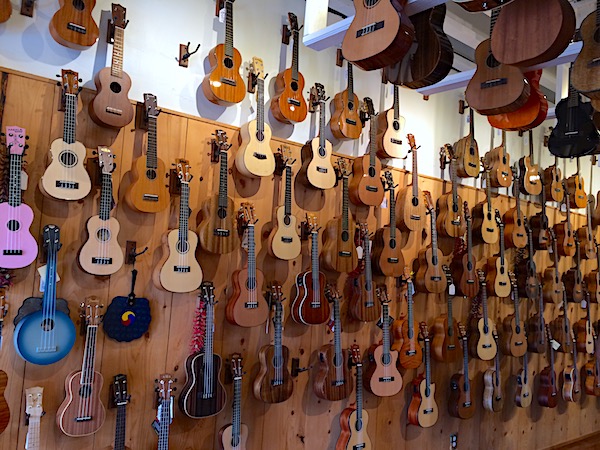
Image resolution: width=600 pixels, height=450 pixels. I want to click on white boards, so click(325, 36), click(451, 81).